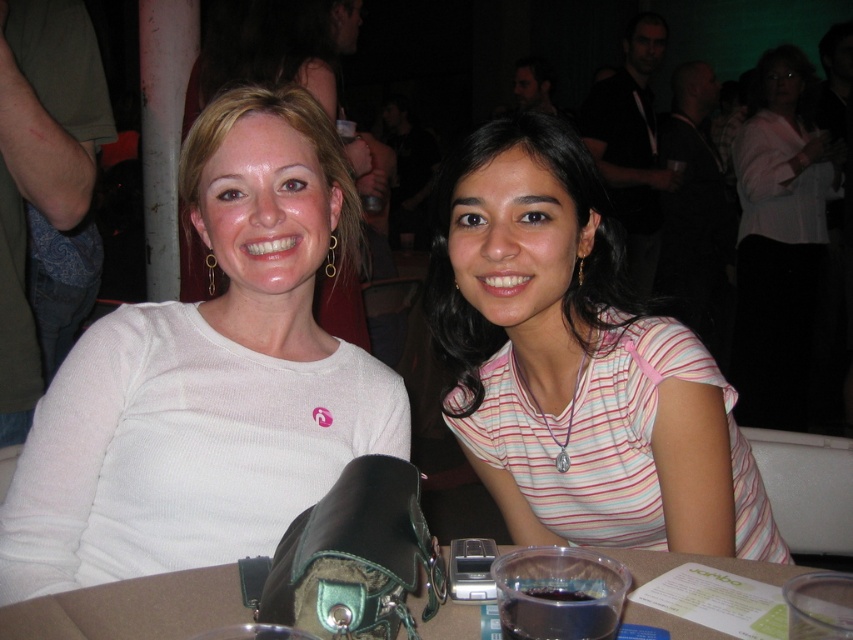
You are a photographer trying to capture a closeup of the white matte sweater at center and the brown leather table at center. Based on their sizes, which object would require you to move closer to get a clear shot?

The white matte sweater at center is much taller than the brown leather table at center, so you would need to move closer to the brown leather table at center to capture it clearly in the photo.

You are a photographer at a social event and need to adjust the lighting so that both the pink striped shirt at center and the pink fabric shirt at center are equally visible. Since one is taller than the other, which one might require more light adjustment to ensure proper exposure?

The pink striped shirt at center has a lesser height compared to the pink fabric shirt at center, so the shorter pink striped shirt at center might require more light adjustment to ensure proper exposure.

You are standing in front of the table and want to place a small item on the white matte sweater at center. Based on its position, where exactly should you aim to place it?

The white matte sweater at center is located at point (207, 378), so you should aim for that coordinate to place the small item there accurately.